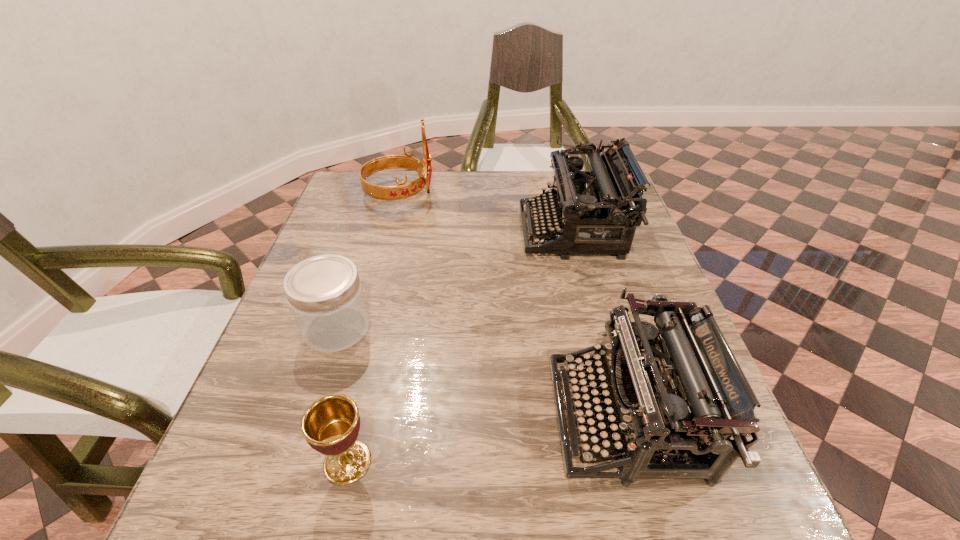
Select which object is the second closest to the tiara. Please provide its 2D coordinates. Your answer should be formatted as a tuple, i.e. [(x, y)], where the tuple contains the x and y coordinates of a point satisfying the conditions above.

[(324, 292)]

Identify the location of free space in the image that satisfies the following two spatial constraints: 1. on the keyboard of the taller typewriter; 2. on the front side of the jar. The width and height of the screenshot is (960, 540). (598, 328).

Find the location of `vacant region that satisfies the following two spatial constraints: 1. on the keyboard of the taller typewriter; 2. on the front side of the jar`. vacant region that satisfies the following two spatial constraints: 1. on the keyboard of the taller typewriter; 2. on the front side of the jar is located at coordinates (598, 328).

This screenshot has height=540, width=960. I want to click on vacant position in the image that satisfies the following two spatial constraints: 1. on the front-facing side of the chalice; 2. on the right side of the tiara, so click(x=331, y=462).

The width and height of the screenshot is (960, 540). What are the coordinates of `vacant space that satisfies the following two spatial constraints: 1. on the back side of the chalice; 2. on the front-facing side of the tiara` in the screenshot? It's located at (409, 193).